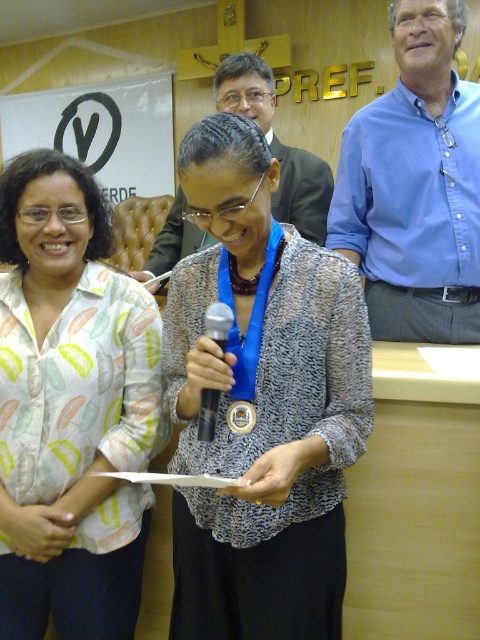
Image resolution: width=480 pixels, height=640 pixels. What do you see at coordinates (262, 403) in the screenshot? I see `blue fabric medal at center` at bounding box center [262, 403].

I want to click on blue fabric medal at center, so click(262, 403).

Find the location of a particular element. blue fabric medal at center is located at coordinates (262, 403).

Which of these two, matte black suit at center or gold metallic medal at center, stands shorter?

With less height is gold metallic medal at center.

Can you confirm if matte black suit at center is positioned to the right of gold metallic medal at center?

Yes, matte black suit at center is to the right of gold metallic medal at center.

Who is more distant from viewer, (225,64) or (230,413)?

The point (225,64) is more distant.

Locate an element on the screen. This screenshot has width=480, height=640. matte black suit at center is located at coordinates (276, 145).

What do you see at coordinates (262, 403) in the screenshot? Image resolution: width=480 pixels, height=640 pixels. I see `blue fabric medal at center` at bounding box center [262, 403].

Locate an element on the screen. The height and width of the screenshot is (640, 480). blue fabric medal at center is located at coordinates (x=262, y=403).

Locate an element on the screen. The height and width of the screenshot is (640, 480). blue fabric medal at center is located at coordinates (262, 403).